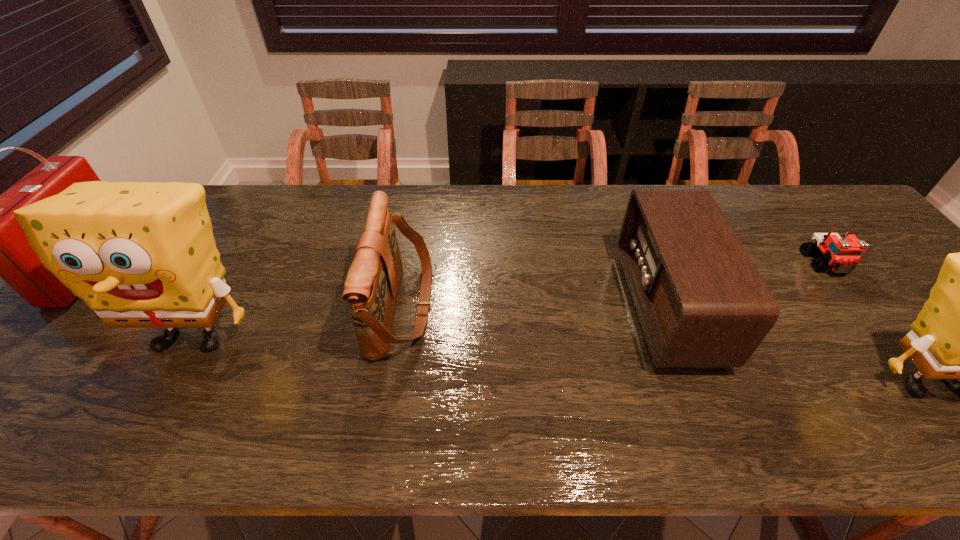
To make them evenly spaced by inserting another sponge among them, please locate a free space for this new sponge. Please provide its 2D coordinates. Your answer should be formatted as a tuple, i.e. [(x, y)], where the tuple contains the x and y coordinates of a point satisfying the conditions above.

[(545, 357)]